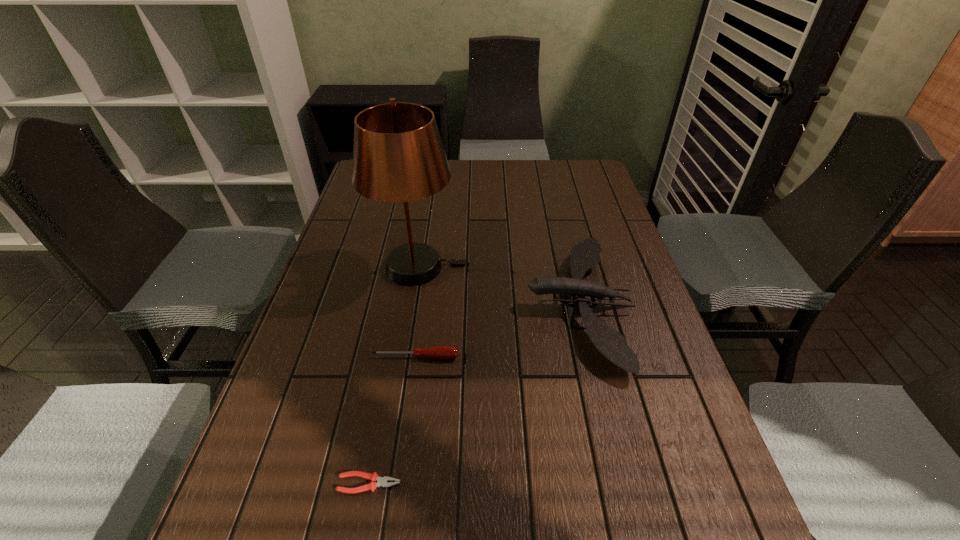
This screenshot has width=960, height=540. I want to click on lampshade, so click(x=398, y=156).

Where is `the rightmost object`? The width and height of the screenshot is (960, 540). the rightmost object is located at coordinates (585, 254).

This screenshot has height=540, width=960. Identify the location of the third shortest object. (585, 254).

This screenshot has width=960, height=540. What are the coordinates of `the second shortest object` in the screenshot? It's located at (441, 352).

The image size is (960, 540). I want to click on pliers, so click(x=382, y=481).

Locate an element on the screen. This screenshot has width=960, height=540. the shortest object is located at coordinates (382, 481).

At what (x,y) coordinates should I click in order to perform the action: click on free space located 0.190m on the front-facing side of the tallest object. Please return your answer as a coordinate pair (x, y). This screenshot has width=960, height=540. Looking at the image, I should click on (532, 267).

The image size is (960, 540). Identify the location of vacant space positioned at the head of the third shortest object. (452, 306).

Identify the location of vacant space located 0.360m at the head of the third shortest object. (387, 306).

At what (x,y) coordinates should I click in order to perform the action: click on free location located at the head of the third shortest object. Please return your answer as a coordinate pair (x, y). The image size is (960, 540). Looking at the image, I should click on (414, 306).